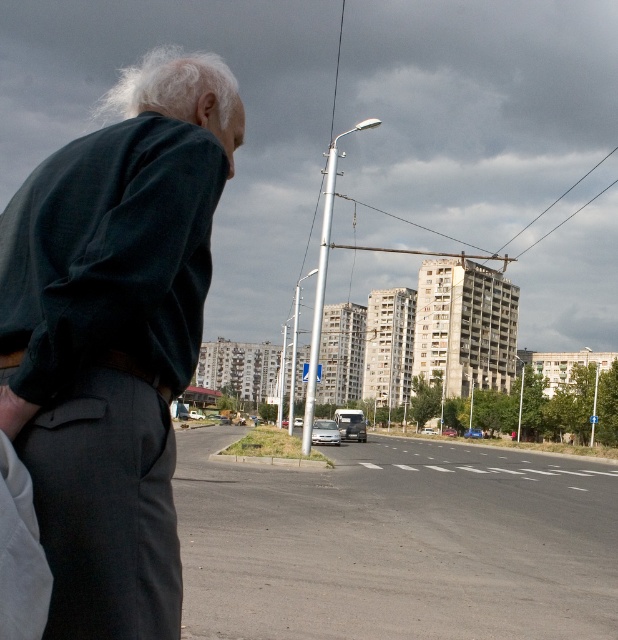
You are a fashion designer analyzing the outfit of the elderly man in the image. Which item is positioned to the left of the other between the dark green fabric jacket at left and the brown leather belt at lower left?

The dark green fabric jacket at left is to the left of the brown leather belt at lower left.

Based on the scene description, can you determine which object is positioned higher in the image between the dark green fabric jacket at left and the brown leather belt at lower left?

The dark green fabric jacket at left is located above the brown leather belt at lower left, so the dark green fabric jacket at left is positioned higher in the image.